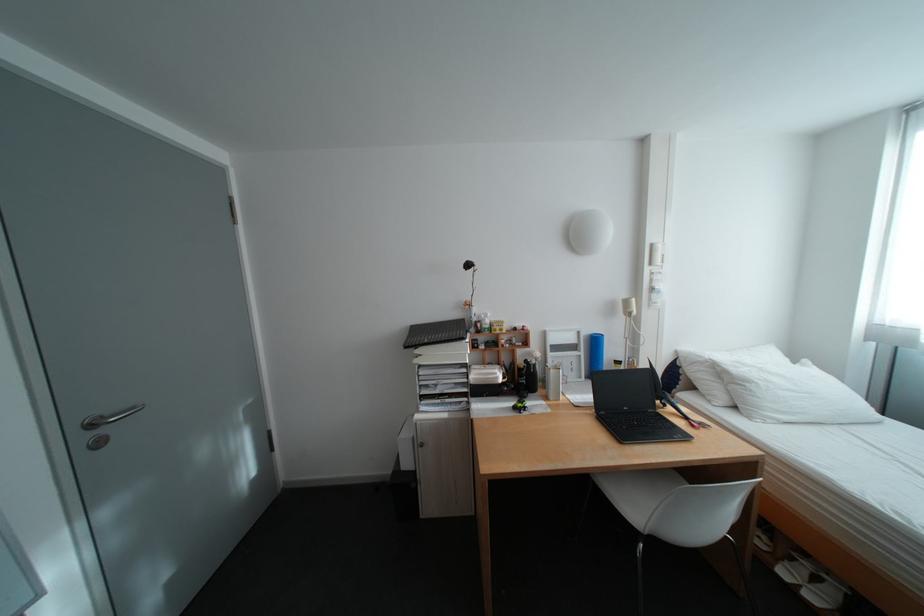
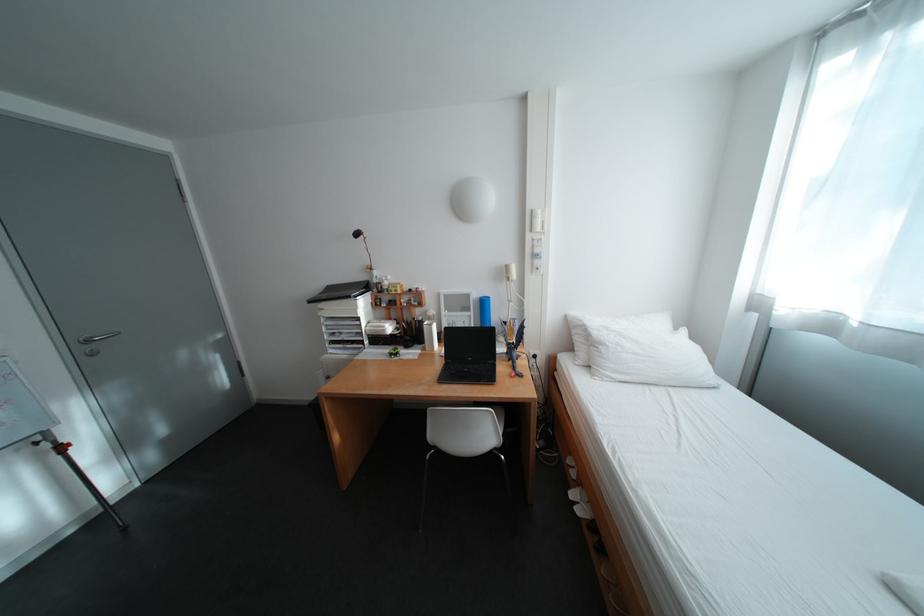
In the second image, find the point that corresponds to [594,354] in the first image.

(484, 314)